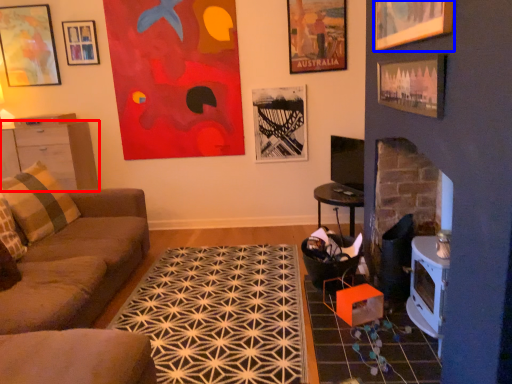
Question: Which object appears closest to the camera in this image, cabinetry (highlighted by a red box) or picture frame (highlighted by a blue box)?

Choices:
 (A) cabinetry
 (B) picture frame

Answer: (B)